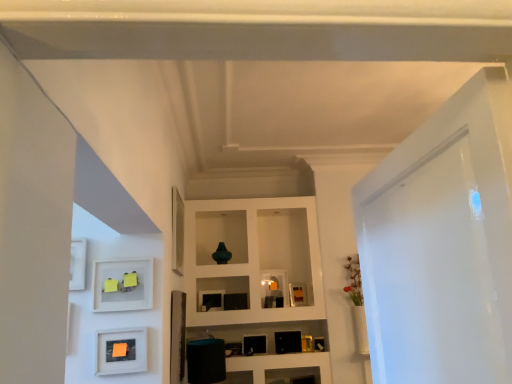
Identify the location of matte white picture frame at center, placed as the 2th picture frame when sorted from right to left. 274,288.

What do you see at coordinates (122, 285) in the screenshot? I see `white matte frame at lower left` at bounding box center [122, 285].

Locate an element on the screen. white glossy door at right is located at coordinates [442, 244].

Is matte white picture frame at center, placed as the 2th picture frame when sorted from right to left, wider than matte black picture frame at center, which ranks as the third picture frame in front-to-back order?

No, matte white picture frame at center, placed as the 2th picture frame when sorted from right to left, is not wider than matte black picture frame at center, which ranks as the third picture frame in front-to-back order.

Is matte white picture frame at center, placed as the 2th picture frame when sorted from right to left, taller or shorter than matte black picture frame at center, the first picture frame from the back?

In the image, matte white picture frame at center, placed as the 2th picture frame when sorted from right to left, appears to be taller than matte black picture frame at center, the first picture frame from the back.

Is matte white picture frame at center, positioned as the 2th picture frame in front-to-back order, aimed at matte black picture frame at center, the third picture frame positioned from the left?

No, matte white picture frame at center, positioned as the 2th picture frame in front-to-back order, does not turn towards matte black picture frame at center, the third picture frame positioned from the left.

Is matte white picture frame at center, placed as the 2th picture frame when sorted from right to left, behind matte black picture frame at center, which appears as the 1th picture frame when viewed from the right?

No.

From a real-world perspective, which is physically below, matte orange paper at lower left, arranged as the third picture frame when viewed from the right, or matte black picture frame at center, which appears as the 1th picture frame when viewed from the right?

From a 3D spatial view, matte orange paper at lower left, arranged as the third picture frame when viewed from the right, is below.

Between matte orange paper at lower left, arranged as the 1th picture frame when viewed from the left, and matte black picture frame at center, the first picture frame from the back, which one has more height?

With more height is matte orange paper at lower left, arranged as the 1th picture frame when viewed from the left.

Who is more distant, matte orange paper at lower left, arranged as the 1th picture frame when viewed from the left, or matte black picture frame at center, which ranks as the third picture frame in front-to-back order?

matte black picture frame at center, which ranks as the third picture frame in front-to-back order, is further from the camera.

From the image's perspective, which is below, white matte frame at lower left or matte black picture frame at center, which ranks as the third picture frame in front-to-back order?

matte black picture frame at center, which ranks as the third picture frame in front-to-back order, appears lower in the image.

Does white matte frame at lower left contain matte black picture frame at center, the third picture frame positioned from the left?

No, matte black picture frame at center, the third picture frame positioned from the left, is located outside of white matte frame at lower left.

Considering the relative sizes of white matte frame at lower left and matte black picture frame at center, the third picture frame positioned from the left, in the image provided, is white matte frame at lower left shorter than matte black picture frame at center, the third picture frame positioned from the left,?

In fact, white matte frame at lower left may be taller than matte black picture frame at center, the third picture frame positioned from the left.

Is white matte frame at lower left directly adjacent to matte black picture frame at center, which ranks as the third picture frame in front-to-back order?

There is a gap between white matte frame at lower left and matte black picture frame at center, which ranks as the third picture frame in front-to-back order.

Looking at the image, does matte orange paper at lower left, arranged as the 1th picture frame when viewed from the left, seem bigger or smaller compared to white matte frame at lower left?

In the image, matte orange paper at lower left, arranged as the 1th picture frame when viewed from the left, appears to be smaller than white matte frame at lower left.

This screenshot has width=512, height=384. Find the location of `shelf that is behind the matte orange paper at lower left, which appears as the 1th picture frame when viewed from the front`. shelf that is behind the matte orange paper at lower left, which appears as the 1th picture frame when viewed from the front is located at coordinates (122, 285).

Based on the photo, is matte orange paper at lower left, which appears as the 1th picture frame when viewed from the front, inside the boundaries of white matte frame at lower left, or outside?

matte orange paper at lower left, which appears as the 1th picture frame when viewed from the front, is not inside white matte frame at lower left, it's outside.

Can you tell me how much matte orange paper at lower left, which is the 3th picture frame from back to front, and white matte frame at lower left differ in facing direction?

The angular difference between matte orange paper at lower left, which is the 3th picture frame from back to front, and white matte frame at lower left is 0.00128 degrees.

In the image, is white glossy door at right on the left side or the right side of matte white picture frame at center, positioned as the 2th picture frame in front-to-back order?

Clearly, white glossy door at right is on the right of matte white picture frame at center, positioned as the 2th picture frame in front-to-back order, in the image.

Which of these two, white glossy door at right or matte white picture frame at center, the 2th picture frame from the back, is wider?

With larger width is white glossy door at right.

From a real-world perspective, is white glossy door at right over matte white picture frame at center, the 2th picture frame from the back?

No, from a real-world perspective, white glossy door at right is not on top of matte white picture frame at center, the 2th picture frame from the back.

From the image's perspective, which one is positioned higher, white glossy door at right or matte white picture frame at center, acting as the 2th picture frame starting from the left?

white glossy door at right.

How different are the orientations of matte white picture frame at center, positioned as the 2th picture frame in front-to-back order, and white glossy door at right in degrees?

The facing directions of matte white picture frame at center, positioned as the 2th picture frame in front-to-back order, and white glossy door at right are 110 degrees apart.

Which of these two, matte white picture frame at center, acting as the 2th picture frame starting from the left, or white glossy door at right, is bigger?

white glossy door at right is bigger.

From the image's perspective, which picture frame is the 2nd one below the white glossy door at right? Please provide its 2D coordinates.

[(274, 288)]

Can you confirm if matte orange paper at lower left, arranged as the 1th picture frame when viewed from the left, is positioned to the right of white glossy door at right?

No, matte orange paper at lower left, arranged as the 1th picture frame when viewed from the left, is not to the right of white glossy door at right.

Considering the sizes of matte orange paper at lower left, arranged as the 1th picture frame when viewed from the left, and white glossy door at right in the image, is matte orange paper at lower left, arranged as the 1th picture frame when viewed from the left, wider or thinner than white glossy door at right?

In the image, matte orange paper at lower left, arranged as the 1th picture frame when viewed from the left, appears to be more narrow than white glossy door at right.

Who is shorter, matte orange paper at lower left, arranged as the 1th picture frame when viewed from the left, or white glossy door at right?

matte orange paper at lower left, arranged as the 1th picture frame when viewed from the left.

Is matte orange paper at lower left, which is the 3th picture frame from back to front, turned away from white glossy door at right?

matte orange paper at lower left, which is the 3th picture frame from back to front, does not have its back to white glossy door at right.

There is a matte black picture frame at center, which appears as the 1th picture frame when viewed from the right. Find the location of `the 1st picture frame above it (from the image's perspective)`. the 1st picture frame above it (from the image's perspective) is located at coordinates (274, 288).

The height and width of the screenshot is (384, 512). There is a matte orange paper at lower left, which appears as the 1th picture frame when viewed from the front. In order to click on the 1st picture frame above it (from a real-world perspective) in this screenshot , I will do `click(298, 294)`.

Based on their spatial positions, is matte white picture frame at center, the 2th picture frame from the back, or white glossy door at right closer to white matte frame at lower left?

white glossy door at right.

Looking at the image, which one is located closer to white matte frame at lower left, matte white picture frame at center, placed as the 2th picture frame when sorted from right to left, or matte black picture frame at center, which ranks as the third picture frame in front-to-back order?

matte white picture frame at center, placed as the 2th picture frame when sorted from right to left.

From the image, which object appears to be nearer to white matte frame at lower left, matte black picture frame at center, which ranks as the third picture frame in front-to-back order, or matte white picture frame at center, positioned as the 2th picture frame in front-to-back order?

matte white picture frame at center, positioned as the 2th picture frame in front-to-back order, lies closer to white matte frame at lower left than the other object.

When comparing their distances from matte orange paper at lower left, which is the 3th picture frame from back to front, does white matte frame at lower left or white glossy door at right seem further?

white glossy door at right.

Which object lies further to the anchor point matte white picture frame at center, positioned as the 2th picture frame in front-to-back order, matte black picture frame at center, which ranks as the third picture frame in front-to-back order, or white glossy door at right?

white glossy door at right lies further to matte white picture frame at center, positioned as the 2th picture frame in front-to-back order, than the other object.

Estimate the real-world distances between objects in this image. Which object is further from white matte frame at lower left, white glossy door at right or matte black picture frame at center, which ranks as the third picture frame in front-to-back order?

The object further to white matte frame at lower left is matte black picture frame at center, which ranks as the third picture frame in front-to-back order.

Looking at the image, which one is located closer to matte orange paper at lower left, arranged as the 1th picture frame when viewed from the left, matte black picture frame at center, the first picture frame from the back, or white matte frame at lower left?

The object closer to matte orange paper at lower left, arranged as the 1th picture frame when viewed from the left, is white matte frame at lower left.

Looking at the image, which one is located closer to white matte frame at lower left, matte orange paper at lower left, arranged as the 1th picture frame when viewed from the left, or white glossy door at right?

The object closer to white matte frame at lower left is matte orange paper at lower left, arranged as the 1th picture frame when viewed from the left.

Locate an element on the screen. The image size is (512, 384). shelf between white glossy door at right and matte black picture frame at center, the first picture frame from the back, from front to back is located at coordinates (122, 285).

The height and width of the screenshot is (384, 512). What are the coordinates of `shelf located between matte orange paper at lower left, which appears as the 1th picture frame when viewed from the front, and matte white picture frame at center, the 2th picture frame from the back, in the depth direction` in the screenshot? It's located at (122, 285).

Locate an element on the screen. This screenshot has width=512, height=384. shelf located between white glossy door at right and matte white picture frame at center, placed as the 2th picture frame when sorted from right to left, in the depth direction is located at coordinates (122, 285).

This screenshot has width=512, height=384. Identify the location of picture frame located between white glossy door at right and white matte frame at lower left in the depth direction. (121, 351).